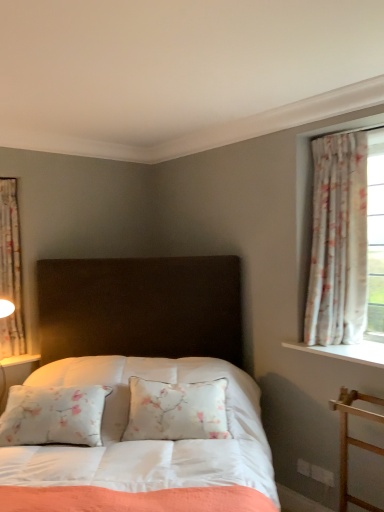
Describe the element at coordinates (338, 242) in the screenshot. I see `floral fabric curtain at right, placed as the first curtain when sorted from right to left` at that location.

Image resolution: width=384 pixels, height=512 pixels. I want to click on satin white bed at center, so click(140, 446).

Locate an element on the screen. This screenshot has width=384, height=512. floral fabric curtain at left, acting as the second curtain starting from the front is located at coordinates (11, 270).

What do you see at coordinates (11, 270) in the screenshot? The height and width of the screenshot is (512, 384). I see `floral fabric curtain at left, placed as the 2th curtain when sorted from right to left` at bounding box center [11, 270].

You are a GUI agent. You are given a task and a screenshot of the screen. Output one action in this format:
    pyautogui.click(x=<x>, y=<y>)
    Task: Click on the floral fabric curtain at right, placed as the first curtain when sorted from right to left
    This screenshot has height=512, width=384.
    Given the screenshot: What is the action you would take?
    pyautogui.click(x=338, y=242)

Is point (3, 261) positioned behind point (337, 219)?

Yes, it is.

From the image's perspective, is floral fabric curtain at left, placed as the 2th curtain when sorted from right to left, on top of floral fabric curtain at right, which is the second curtain from left to right?

No, from the image's perspective, floral fabric curtain at left, placed as the 2th curtain when sorted from right to left, is not on top of floral fabric curtain at right, which is the second curtain from left to right.

Does floral fabric curtain at left, acting as the first curtain starting from the left, have a smaller size compared to floral fabric curtain at right, positioned as the 1th curtain in front-to-back order?

Indeed, floral fabric curtain at left, acting as the first curtain starting from the left, has a smaller size compared to floral fabric curtain at right, positioned as the 1th curtain in front-to-back order.

Considering the sizes of objects floral fabric curtain at left, acting as the second curtain starting from the front, and floral fabric curtain at right, the 2th curtain positioned from the back, in the image provided, who is taller, floral fabric curtain at left, acting as the second curtain starting from the front, or floral fabric curtain at right, the 2th curtain positioned from the back,?

With more height is floral fabric curtain at right, the 2th curtain positioned from the back.

From the image's perspective, does satin white bed at center appear higher than floral fabric curtain at left, acting as the first curtain starting from the left?

Incorrect, from the image's perspective, satin white bed at center is lower than floral fabric curtain at left, acting as the first curtain starting from the left.

Looking at their sizes, would you say satin white bed at center is wider or thinner than floral fabric curtain at left, placed as the 2th curtain when sorted from right to left?

satin white bed at center is wider than floral fabric curtain at left, placed as the 2th curtain when sorted from right to left.

Would you say satin white bed at center is a long distance from floral fabric curtain at left, the first curtain when ordered from back to front?

Absolutely, satin white bed at center is distant from floral fabric curtain at left, the first curtain when ordered from back to front.

Is floral fabric curtain at left, acting as the second curtain starting from the front, bigger or smaller than satin white bed at center?

Considering their sizes, floral fabric curtain at left, acting as the second curtain starting from the front, takes up less space than satin white bed at center.

Is floral fabric curtain at left, acting as the second curtain starting from the front, looking in the opposite direction of satin white bed at center?

No.

Is point (6, 327) positioned behind point (59, 504)?

Yes, it is behind point (59, 504).

Is floral fabric curtain at left, the first curtain when ordered from back to front, next to satin white bed at center and touching it?

No, floral fabric curtain at left, the first curtain when ordered from back to front, is not with satin white bed at center.

Can you confirm if satin white bed at center is positioned to the left of floral fabric curtain at right, placed as the first curtain when sorted from right to left?

Yes.

In the scene shown: Does satin white bed at center have a smaller size compared to floral fabric curtain at right, which is the second curtain from left to right?

No, satin white bed at center is not smaller than floral fabric curtain at right, which is the second curtain from left to right.

Is satin white bed at center positioned far away from floral fabric curtain at right, placed as the first curtain when sorted from right to left?

Yes, satin white bed at center is far from floral fabric curtain at right, placed as the first curtain when sorted from right to left.

Considering the sizes of satin white bed at center and floral fabric curtain at right, the 2th curtain positioned from the back, in the image, is satin white bed at center taller or shorter than floral fabric curtain at right, the 2th curtain positioned from the back,?

Considering their sizes, satin white bed at center has more height than floral fabric curtain at right, the 2th curtain positioned from the back.

Considering the sizes of floral fabric curtain at right, the 2th curtain positioned from the back, and satin white bed at center in the image, is floral fabric curtain at right, the 2th curtain positioned from the back, wider or thinner than satin white bed at center?

Clearly, floral fabric curtain at right, the 2th curtain positioned from the back, has less width compared to satin white bed at center.

From a real-world perspective, who is located higher, floral fabric curtain at right, positioned as the 1th curtain in front-to-back order, or satin white bed at center?

floral fabric curtain at right, positioned as the 1th curtain in front-to-back order.

Who is shorter, floral fabric curtain at right, positioned as the 1th curtain in front-to-back order, or satin white bed at center?

floral fabric curtain at right, positioned as the 1th curtain in front-to-back order, is shorter.

Is floral fabric curtain at right, placed as the first curtain when sorted from right to left, positioned far away from floral fabric curtain at left, acting as the second curtain starting from the front?

Yes, floral fabric curtain at right, placed as the first curtain when sorted from right to left, is far from floral fabric curtain at left, acting as the second curtain starting from the front.

From a real-world perspective, is floral fabric curtain at right, the 2th curtain positioned from the back, positioned above or below floral fabric curtain at left, acting as the second curtain starting from the front?

From a real-world perspective, floral fabric curtain at right, the 2th curtain positioned from the back, is physically above floral fabric curtain at left, acting as the second curtain starting from the front.

Is floral fabric curtain at right, positioned as the 1th curtain in front-to-back order, taller than floral fabric curtain at left, acting as the second curtain starting from the front?

Indeed, floral fabric curtain at right, positioned as the 1th curtain in front-to-back order, has a greater height compared to floral fabric curtain at left, acting as the second curtain starting from the front.

The width and height of the screenshot is (384, 512). Find the location of `curtain above the floral fabric curtain at left, acting as the first curtain starting from the left (from a real-world perspective)`. curtain above the floral fabric curtain at left, acting as the first curtain starting from the left (from a real-world perspective) is located at coordinates (338, 242).

Find the location of a particular element. the 2nd curtain behind when counting from the satin white bed at center is located at coordinates (11, 270).

Based on their spatial positions, is floral fabric curtain at left, placed as the 2th curtain when sorted from right to left, or satin white bed at center further from floral fabric curtain at right, placed as the first curtain when sorted from right to left?

floral fabric curtain at left, placed as the 2th curtain when sorted from right to left, is positioned further to the anchor floral fabric curtain at right, placed as the first curtain when sorted from right to left.

Which object lies nearer to the anchor point floral fabric curtain at left, the first curtain when ordered from back to front, satin white bed at center or floral fabric curtain at right, the 2th curtain positioned from the back?

satin white bed at center lies closer to floral fabric curtain at left, the first curtain when ordered from back to front, than the other object.

Consider the image. Considering their positions, is satin white bed at center positioned further to floral fabric curtain at right, the 2th curtain positioned from the back, than floral fabric curtain at left, placed as the 2th curtain when sorted from right to left?

floral fabric curtain at left, placed as the 2th curtain when sorted from right to left, lies further to floral fabric curtain at right, the 2th curtain positioned from the back, than the other object.

Considering their positions, is floral fabric curtain at left, acting as the second curtain starting from the front, positioned further to satin white bed at center than floral fabric curtain at right, which is the second curtain from left to right?

floral fabric curtain at left, acting as the second curtain starting from the front.

From the image, which object appears to be farther from floral fabric curtain at left, the first curtain when ordered from back to front, floral fabric curtain at right, the 2th curtain positioned from the back, or satin white bed at center?

floral fabric curtain at right, the 2th curtain positioned from the back.

Estimate the real-world distances between objects in this image. Which object is further from satin white bed at center, floral fabric curtain at right, positioned as the 1th curtain in front-to-back order, or floral fabric curtain at left, acting as the second curtain starting from the front?

floral fabric curtain at left, acting as the second curtain starting from the front, is further to satin white bed at center.

Locate an element on the screen. curtain between satin white bed at center and floral fabric curtain at left, acting as the second curtain starting from the front, from front to back is located at coordinates (338, 242).